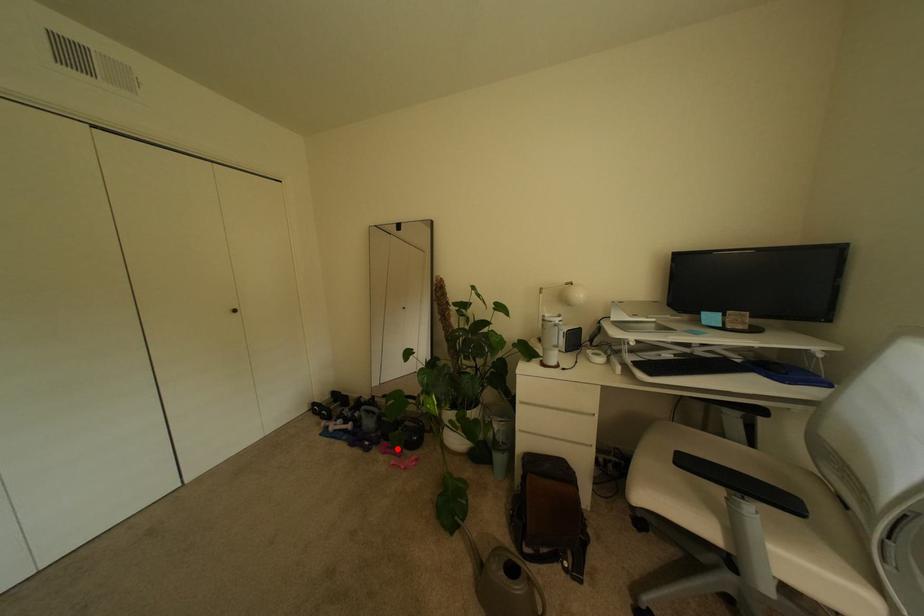
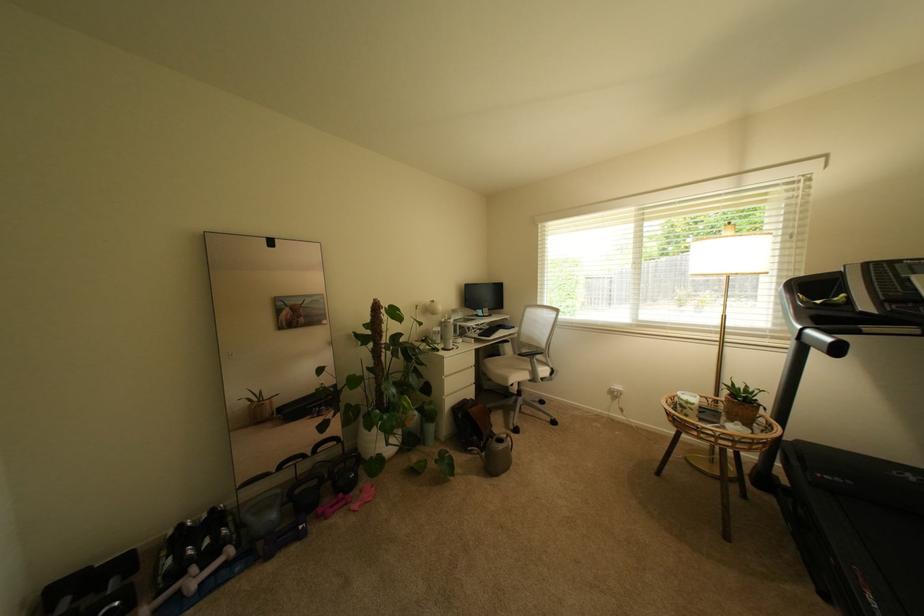
Question: I am providing you with two images of the same scene from different viewpoints. Given a red point in image1, look at the same physical point in image2. Is it:

Choices:
 (A) Closer to the viewpoint
 (B) Farther from the viewpoint

Answer: (A)